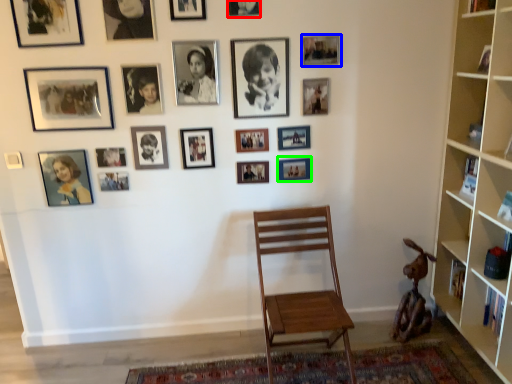
Question: Which is nearer to the picture frame (highlighted by a red box)? picture frame (highlighted by a blue box) or picture frame (highlighted by a green box).

Choices:
 (A) picture frame
 (B) picture frame

Answer: (A)